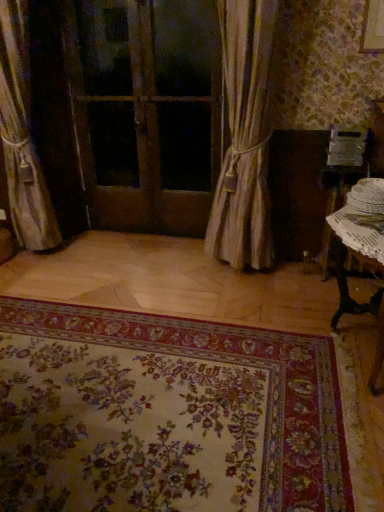
The height and width of the screenshot is (512, 384). I want to click on free space to the left of white wicker table at lower right, which appears as the first table when viewed from the front, so click(254, 355).